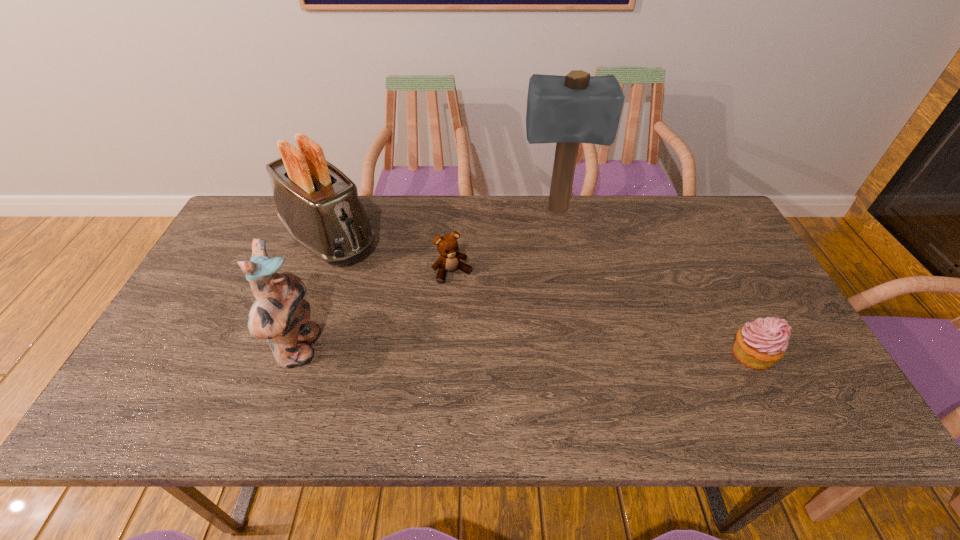
Find the location of `figurine`. figurine is located at coordinates (279, 313).

This screenshot has height=540, width=960. In order to click on cupcake in this screenshot , I will do `click(759, 344)`.

I want to click on teddy bear, so click(447, 245).

Where is `toaster`? The image size is (960, 540). toaster is located at coordinates (318, 204).

Identify the location of the fourth object from left to right. Image resolution: width=960 pixels, height=540 pixels. (577, 108).

What are the coordinates of `mallet` in the screenshot? It's located at (577, 108).

Where is `vacant space located on the front-facing side of the figurine`? vacant space located on the front-facing side of the figurine is located at coordinates (446, 349).

Locate an element on the screen. The image size is (960, 540). vacant space situated 0.340m on the left of the rightmost object is located at coordinates (588, 355).

At what (x,y) coordinates should I click in order to perform the action: click on vacant space located on the front-facing side of the teddy bear. Please return your answer as a coordinate pair (x, y). The image size is (960, 540). Looking at the image, I should click on (473, 303).

Identify the location of free space located 0.190m on the front-facing side of the teddy bear. This screenshot has height=540, width=960. (492, 333).